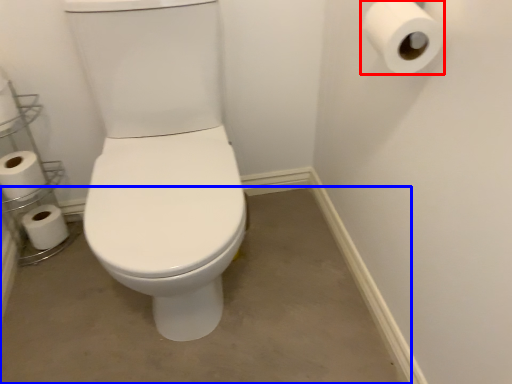
Question: Which object is closer to the camera taking this photo, toilet paper (highlighted by a red box) or concrete (highlighted by a blue box)?

Choices:
 (A) toilet paper
 (B) concrete

Answer: (A)